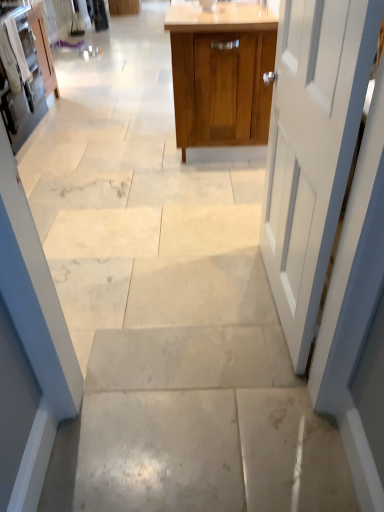
Describe the element at coordinates (312, 149) in the screenshot. The width and height of the screenshot is (384, 512). I see `white painted wood door at right` at that location.

The width and height of the screenshot is (384, 512). I want to click on matte white cabinet at left, which is counted as the second cabinetry, starting from the left, so click(25, 72).

From the image's perspective, is matte white cabinet at upper left, the 1th cabinetry from the left, positioned above or below white painted wood door at right?

matte white cabinet at upper left, the 1th cabinetry from the left, is situated higher than white painted wood door at right in the image.

From their relative heights in the image, would you say matte white cabinet at upper left, the 1th cabinetry from the left, is taller or shorter than white painted wood door at right?

In the image, matte white cabinet at upper left, the 1th cabinetry from the left, appears to be shorter than white painted wood door at right.

Is matte white cabinet at upper left, which is the third cabinetry in right-to-left order, looking in the opposite direction of white painted wood door at right?

matte white cabinet at upper left, which is the third cabinetry in right-to-left order, is not turned away from white painted wood door at right.

Is matte white cabinet at upper left, which is the third cabinetry in right-to-left order, aimed at matte white cabinet at left, which is counted as the second cabinetry, starting from the right?

No, matte white cabinet at upper left, which is the third cabinetry in right-to-left order, does not turn towards matte white cabinet at left, which is counted as the second cabinetry, starting from the right.

Is matte white cabinet at upper left, the 1th cabinetry from the left, not inside matte white cabinet at left, which is counted as the second cabinetry, starting from the right?

Yes, matte white cabinet at upper left, the 1th cabinetry from the left, is not within matte white cabinet at left, which is counted as the second cabinetry, starting from the right.

In terms of width, does matte white cabinet at upper left, which is the third cabinetry in right-to-left order, look wider or thinner when compared to matte white cabinet at left, which is counted as the second cabinetry, starting from the right?

In the image, matte white cabinet at upper left, which is the third cabinetry in right-to-left order, appears to be more narrow than matte white cabinet at left, which is counted as the second cabinetry, starting from the right.

Does matte white cabinet at upper left, the 1th cabinetry from the left, have a smaller size compared to matte white cabinet at left, which is counted as the second cabinetry, starting from the right?

Correct, matte white cabinet at upper left, the 1th cabinetry from the left, occupies less space than matte white cabinet at left, which is counted as the second cabinetry, starting from the right.

From the image's perspective, between matte white cabinet at left, which is counted as the second cabinetry, starting from the left, and white painted wood door at right, which one is located above?

From the image's view, matte white cabinet at left, which is counted as the second cabinetry, starting from the left, is above.

Considering the sizes of matte white cabinet at left, which is counted as the second cabinetry, starting from the right, and white painted wood door at right in the image, is matte white cabinet at left, which is counted as the second cabinetry, starting from the right, wider or thinner than white painted wood door at right?

Clearly, matte white cabinet at left, which is counted as the second cabinetry, starting from the right, has more width compared to white painted wood door at right.

From a real-world perspective, is matte white cabinet at left, which is counted as the second cabinetry, starting from the left, physically located above or below white painted wood door at right?

From a real-world perspective, matte white cabinet at left, which is counted as the second cabinetry, starting from the left, is physically below white painted wood door at right.

From the image's perspective, is white painted wood door at right above wooden cabinet at center, the third cabinetry positioned from the left?

No.

Would you consider white painted wood door at right to be distant from wooden cabinet at center, which ranks as the 1th cabinetry in right-to-left order?

Absolutely, white painted wood door at right is distant from wooden cabinet at center, which ranks as the 1th cabinetry in right-to-left order.

Is wooden cabinet at center, which ranks as the 1th cabinetry in right-to-left order, a part of white painted wood door at right?

No, wooden cabinet at center, which ranks as the 1th cabinetry in right-to-left order, is not surrounded by white painted wood door at right.

Does white painted wood door at right have a lesser width compared to wooden cabinet at center, which ranks as the 1th cabinetry in right-to-left order?

Correct, the width of white painted wood door at right is less than that of wooden cabinet at center, which ranks as the 1th cabinetry in right-to-left order.

Between wooden cabinet at center, the third cabinetry positioned from the left, and matte white cabinet at left, which is counted as the second cabinetry, starting from the right, which one has less height?

Standing shorter between the two is matte white cabinet at left, which is counted as the second cabinetry, starting from the right.

How different are the orientations of wooden cabinet at center, which ranks as the 1th cabinetry in right-to-left order, and matte white cabinet at left, which is counted as the second cabinetry, starting from the left, in degrees?

The angle between the facing direction of wooden cabinet at center, which ranks as the 1th cabinetry in right-to-left order, and the facing direction of matte white cabinet at left, which is counted as the second cabinetry, starting from the left, is 90.2 degrees.

Can matte white cabinet at left, which is counted as the second cabinetry, starting from the right, be found inside wooden cabinet at center, the third cabinetry positioned from the left?

Actually, matte white cabinet at left, which is counted as the second cabinetry, starting from the right, is outside wooden cabinet at center, the third cabinetry positioned from the left.

Does wooden cabinet at center, the third cabinetry positioned from the left, turn towards matte white cabinet at left, which is counted as the second cabinetry, starting from the right?

No, wooden cabinet at center, the third cabinetry positioned from the left, is not turned towards matte white cabinet at left, which is counted as the second cabinetry, starting from the right.

From a real-world perspective, is matte white cabinet at upper left, the 1th cabinetry from the left, positioned under wooden cabinet at center, the third cabinetry positioned from the left, based on gravity?

Indeed, from a real-world perspective, matte white cabinet at upper left, the 1th cabinetry from the left, is positioned beneath wooden cabinet at center, the third cabinetry positioned from the left.

Does matte white cabinet at upper left, the 1th cabinetry from the left, have a greater height compared to wooden cabinet at center, which ranks as the 1th cabinetry in right-to-left order?

Incorrect, the height of matte white cabinet at upper left, the 1th cabinetry from the left, is not larger of that of wooden cabinet at center, which ranks as the 1th cabinetry in right-to-left order.

From the image's perspective, starting from the matte white cabinet at upper left, which is the third cabinetry in right-to-left order, which cabinetry is the 1st one below? Please provide its 2D coordinates.

[(221, 73)]

Which is closer to the camera, (42, 28) or (242, 31)?

The point (242, 31) is in front.

Which object is positioned more to the left, matte white cabinet at left, which is counted as the second cabinetry, starting from the right, or wooden cabinet at center, which ranks as the 1th cabinetry in right-to-left order?

From the viewer's perspective, matte white cabinet at left, which is counted as the second cabinetry, starting from the right, appears more on the left side.

How many degrees apart are the facing directions of matte white cabinet at left, which is counted as the second cabinetry, starting from the right, and wooden cabinet at center, which ranks as the 1th cabinetry in right-to-left order?

matte white cabinet at left, which is counted as the second cabinetry, starting from the right, and wooden cabinet at center, which ranks as the 1th cabinetry in right-to-left order, are facing 90.2 degrees away from each other.

From the image's perspective, between matte white cabinet at left, which is counted as the second cabinetry, starting from the right, and wooden cabinet at center, the third cabinetry positioned from the left, which one is located above?

wooden cabinet at center, the third cabinetry positioned from the left, is shown above in the image.

Can you confirm if matte white cabinet at left, which is counted as the second cabinetry, starting from the right, is bigger than wooden cabinet at center, the third cabinetry positioned from the left?

No.

Image resolution: width=384 pixels, height=512 pixels. Identify the location of the 3rd cabinetry behind the white painted wood door at right. (43, 50).

From the image's perspective, which cabinetry is the 2nd one below the matte white cabinet at upper left, which is the third cabinetry in right-to-left order? Please provide its 2D coordinates.

[(25, 72)]

When comparing their distances from wooden cabinet at center, which ranks as the 1th cabinetry in right-to-left order, does matte white cabinet at upper left, which is the third cabinetry in right-to-left order, or matte white cabinet at left, which is counted as the second cabinetry, starting from the right, seem closer?

The object closer to wooden cabinet at center, which ranks as the 1th cabinetry in right-to-left order, is matte white cabinet at left, which is counted as the second cabinetry, starting from the right.

Based on their spatial positions, is wooden cabinet at center, the third cabinetry positioned from the left, or matte white cabinet at left, which is counted as the second cabinetry, starting from the right, further from matte white cabinet at upper left, which is the third cabinetry in right-to-left order?

Based on the image, wooden cabinet at center, the third cabinetry positioned from the left, appears to be further to matte white cabinet at upper left, which is the third cabinetry in right-to-left order.

From the picture: When comparing their distances from white painted wood door at right, does matte white cabinet at left, which is counted as the second cabinetry, starting from the right, or matte white cabinet at upper left, the 1th cabinetry from the left, seem further?

matte white cabinet at upper left, the 1th cabinetry from the left, is positioned further to the anchor white painted wood door at right.

Considering their positions, is matte white cabinet at upper left, which is the third cabinetry in right-to-left order, positioned closer to white painted wood door at right than matte white cabinet at left, which is counted as the second cabinetry, starting from the left?

The object closer to white painted wood door at right is matte white cabinet at left, which is counted as the second cabinetry, starting from the left.

Considering their positions, is white painted wood door at right positioned closer to matte white cabinet at left, which is counted as the second cabinetry, starting from the left, than matte white cabinet at upper left, which is the third cabinetry in right-to-left order?

matte white cabinet at upper left, which is the third cabinetry in right-to-left order, is closer to matte white cabinet at left, which is counted as the second cabinetry, starting from the left.

Based on their spatial positions, is matte white cabinet at left, which is counted as the second cabinetry, starting from the right, or white painted wood door at right further from matte white cabinet at upper left, which is the third cabinetry in right-to-left order?

Based on the image, white painted wood door at right appears to be further to matte white cabinet at upper left, which is the third cabinetry in right-to-left order.

Which object lies nearer to the anchor point matte white cabinet at upper left, the 1th cabinetry from the left, matte white cabinet at left, which is counted as the second cabinetry, starting from the right, or wooden cabinet at center, which ranks as the 1th cabinetry in right-to-left order?

Among the two, matte white cabinet at left, which is counted as the second cabinetry, starting from the right, is located nearer to matte white cabinet at upper left, the 1th cabinetry from the left.

From the image, which object appears to be farther from wooden cabinet at center, the third cabinetry positioned from the left, matte white cabinet at left, which is counted as the second cabinetry, starting from the left, or white painted wood door at right?

matte white cabinet at left, which is counted as the second cabinetry, starting from the left, is further to wooden cabinet at center, the third cabinetry positioned from the left.

Locate an element on the screen. Image resolution: width=384 pixels, height=512 pixels. cabinetry between wooden cabinet at center, which ranks as the 1th cabinetry in right-to-left order, and matte white cabinet at upper left, which is the third cabinetry in right-to-left order, from front to back is located at coordinates (25, 72).

Image resolution: width=384 pixels, height=512 pixels. I want to click on door between matte white cabinet at left, which is counted as the second cabinetry, starting from the left, and wooden cabinet at center, which ranks as the 1th cabinetry in right-to-left order, from left to right, so click(x=312, y=149).